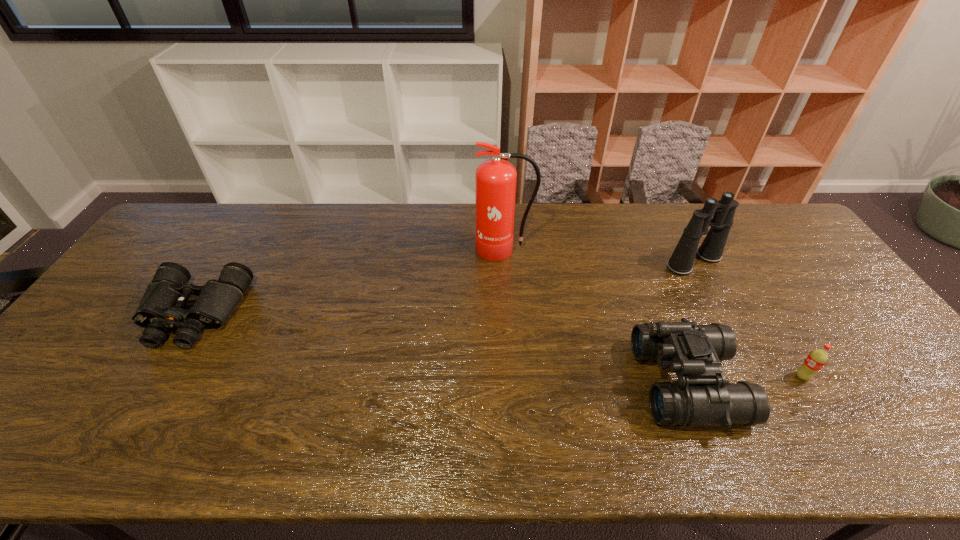
Identify the location of vacant space that's between the soda and the third shortest object. [745, 380].

Identify the location of free space that is in between the second tallest binoculars and the soda. Image resolution: width=960 pixels, height=540 pixels. click(x=745, y=380).

Find the location of a particular element. This screenshot has width=960, height=540. vacant area that lies between the second object from left to right and the soda is located at coordinates (653, 313).

Identify the location of object that stands as the fourth closest to the third tallest object. This screenshot has height=540, width=960. (161, 308).

Locate an element on the screen. This screenshot has width=960, height=540. object that can be found as the second closest to the second shortest binoculars is located at coordinates (711, 250).

Choose which binoculars is the nearest neighbor to the soda. Please provide its 2D coordinates. Your answer should be formatted as a tuple, i.e. [(x, y)], where the tuple contains the x and y coordinates of a point satisfying the conditions above.

[(702, 396)]

Locate an element on the screen. binoculars that is the second closest to the tallest binoculars is located at coordinates (161, 308).

The height and width of the screenshot is (540, 960). Identify the location of vacant space that satisfies the following two spatial constraints: 1. through the eyepieces of the shortest object; 2. on the right side of the soda. 156,376.

At what (x,y) coordinates should I click in order to perform the action: click on vacant position in the image that satisfies the following two spatial constraints: 1. towards the nozzle of the fourth tallest object; 2. on the left side of the tallest object. Please return your answer as a coordinate pair (x, y). Looking at the image, I should click on (513, 376).

Identify the location of free space that satisfies the following two spatial constraints: 1. through the eyepieces of the leftmost object; 2. on the right side of the rightmost object. This screenshot has width=960, height=540. (156, 376).